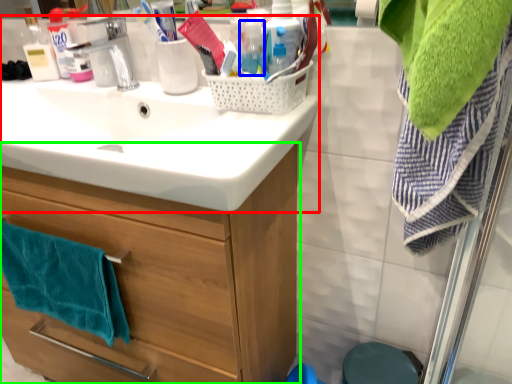
Question: Estimate the real-world distances between objects in this image. Which object is farther from sink (highlighted by a red box), bottle (highlighted by a blue box) or bathroom cabinet (highlighted by a green box)?

Choices:
 (A) bottle
 (B) bathroom cabinet

Answer: (A)